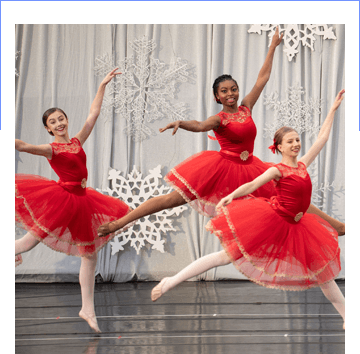
Identify the location of curtain. The height and width of the screenshot is (354, 360). (213, 43).